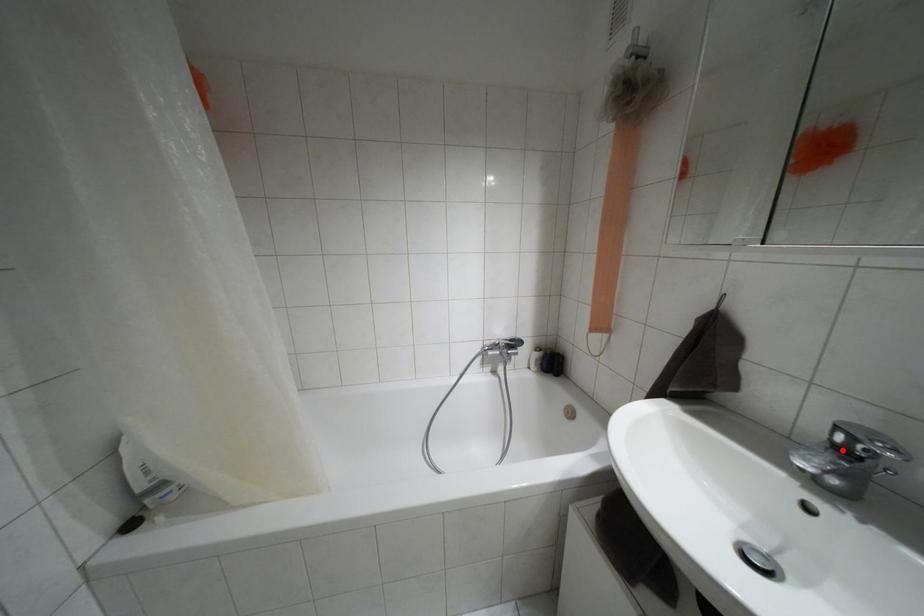
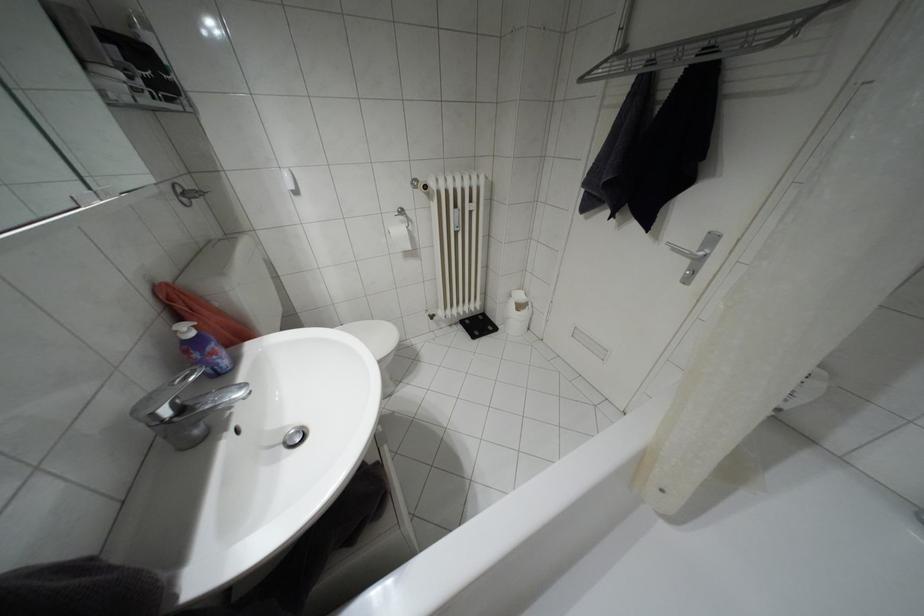
Find the pixel in the second image that matches the highlighted location in the first image.

(180, 408)